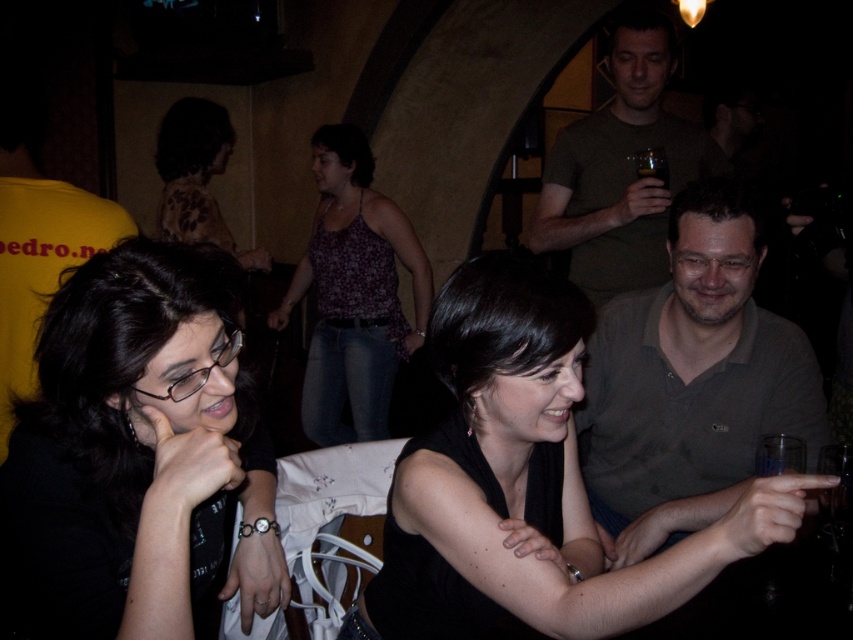
Does black matte hair at center have a lesser height compared to black matte dress at center?

Correct, black matte hair at center is not as tall as black matte dress at center.

Between point (260, 467) and point (457, 268), which one is positioned in front?

Point (457, 268) is in front.

Locate an element on the screen. Image resolution: width=853 pixels, height=640 pixels. black matte hair at center is located at coordinates (141, 449).

Can you confirm if black matte hair at center is wider than floral-patterned blouse at upper left?

In fact, black matte hair at center might be narrower than floral-patterned blouse at upper left.

Find the location of a particular element. black matte hair at center is located at coordinates (x=141, y=449).

Find the location of a particular element. black matte hair at center is located at coordinates (141, 449).

Between gray cotton shirt at center and floral tank top at center, which one is positioned lower?

gray cotton shirt at center

I want to click on gray cotton shirt at center, so click(691, 380).